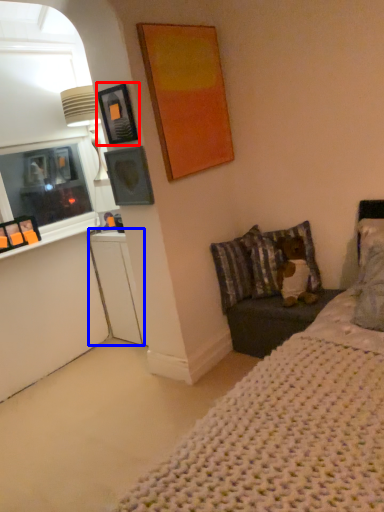
Question: Which point is further to the camera, picture frame (highlighted by a red box) or dresser (highlighted by a blue box)?

Choices:
 (A) picture frame
 (B) dresser

Answer: (B)